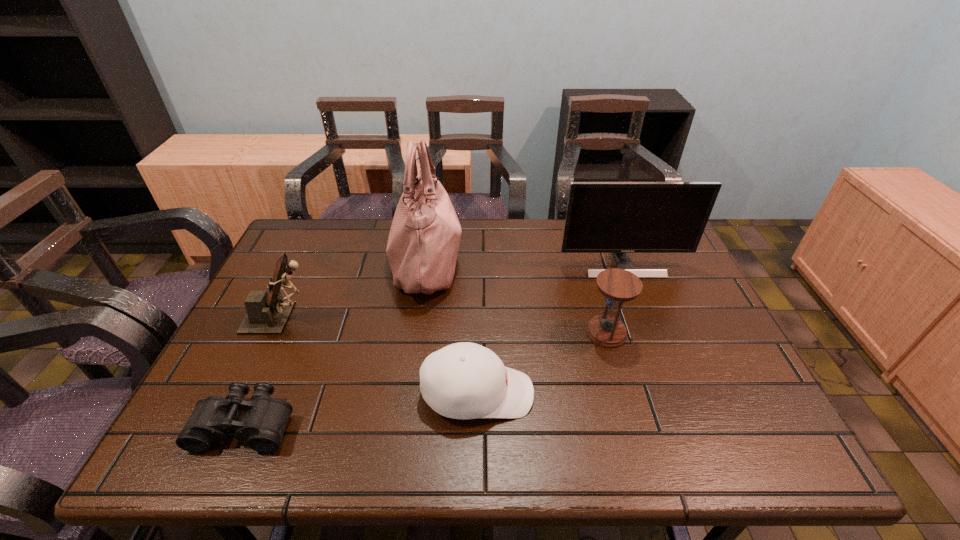
Find the location of a particular element. vacant region located on the front-facing side of the baseball cap is located at coordinates (626, 394).

Locate an element on the screen. handbag that is at the far edge is located at coordinates click(422, 248).

Where is `monitor positioned at the far edge`? monitor positioned at the far edge is located at coordinates (601, 217).

Locate an element on the screen. Image resolution: width=960 pixels, height=540 pixels. baseball cap present at the near edge is located at coordinates (465, 380).

At what (x,y) coordinates should I click in order to perform the action: click on binoculars present at the near edge. Please return your answer as a coordinate pair (x, y). The height and width of the screenshot is (540, 960). Looking at the image, I should click on (262, 426).

The height and width of the screenshot is (540, 960). What are the coordinates of `figurine at the left edge` in the screenshot? It's located at (267, 313).

The height and width of the screenshot is (540, 960). Identify the location of binoculars at the left edge. pyautogui.click(x=262, y=426).

Locate an element on the screen. The image size is (960, 540). object at the right edge is located at coordinates (601, 217).

Where is `object at the near left corner`? This screenshot has height=540, width=960. object at the near left corner is located at coordinates (262, 426).

This screenshot has width=960, height=540. I want to click on object that is at the far right corner, so click(x=601, y=217).